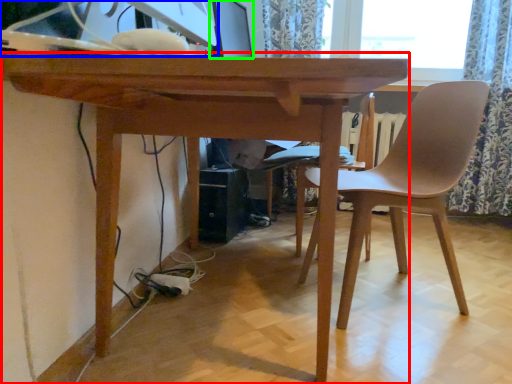
Question: Based on their relative distances, which object is nearer to table (highlighted by a red box)? Choose from desktop computer (highlighted by a blue box) and computer monitor (highlighted by a green box).

Choices:
 (A) desktop computer
 (B) computer monitor

Answer: (A)